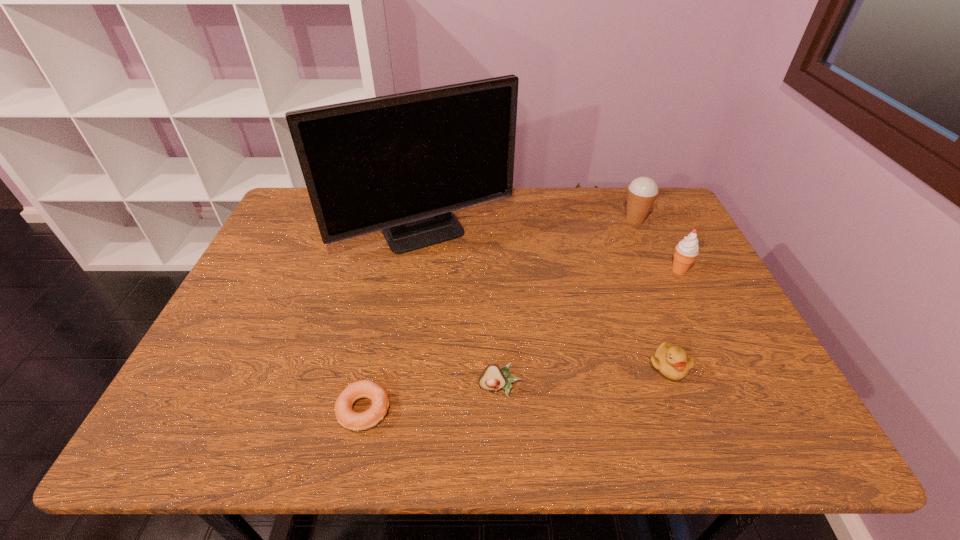
Locate an element on the screen. The width and height of the screenshot is (960, 540). object that stands as the second closest to the duckling is located at coordinates (492, 378).

Image resolution: width=960 pixels, height=540 pixels. I want to click on object that ranks as the fourth closest to the farther icecream, so click(492, 378).

In order to click on vacant space that satisfies the following two spatial constraints: 1. on the back side of the bagel; 2. on the left side of the farther icecream in this screenshot , I will do `click(404, 220)`.

Identify the location of free location that satisfies the following two spatial constraints: 1. on the front-facing side of the computer monitor; 2. on the left side of the nearer icecream. (420, 270).

Identify the location of vacant space that satisfies the following two spatial constraints: 1. on the back side of the farther icecream; 2. on the left side of the shortest object. (404, 220).